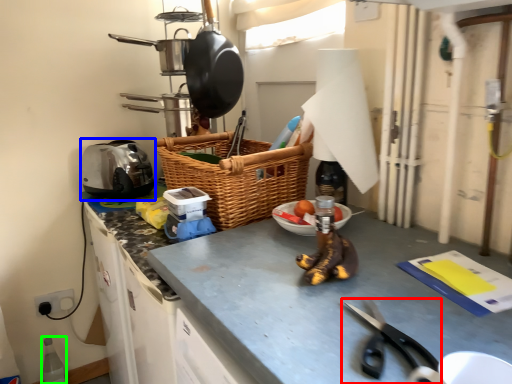
Question: Which object is positioned closest to scissors (highlighted by a red box)? Select from appliance (highlighted by a blue box) and bottle (highlighted by a green box).

Choices:
 (A) appliance
 (B) bottle

Answer: (A)